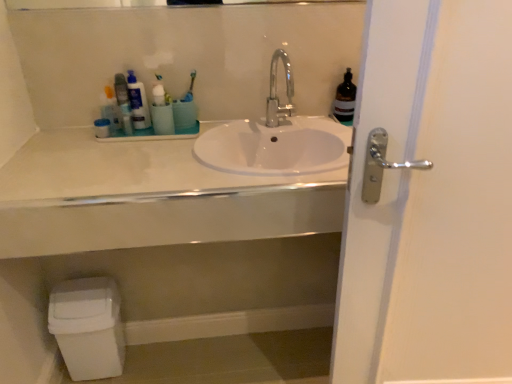
Find the location of a particular element. The height and width of the screenshot is (384, 512). spots to the right of white plastic toilet bowl at lower left is located at coordinates (151, 358).